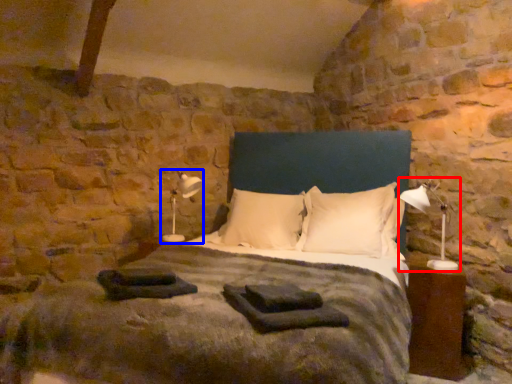
Question: Among these objects, which one is farthest to the camera, table lamp (highlighted by a red box) or table lamp (highlighted by a blue box)?

Choices:
 (A) table lamp
 (B) table lamp

Answer: (B)